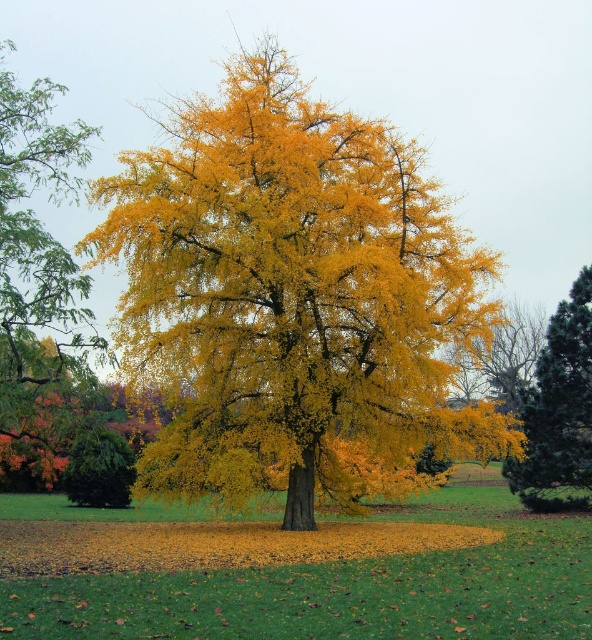
You are standing in a park and see two trees at the center. One is a yellow leafy tree at center and the other is a yellow matte tree at center. Which one do you think is closer to you?

The yellow leafy tree at center is closer to the viewer than the yellow matte tree at center.

You are standing at the center of the image and want to walk towards the shiny dark green pine tree at right. In which direction should you move?

The shiny dark green pine tree at right is located at point 0.642 on the x axis and 0.944 on the y axis. Since you are at the center, you should move towards the right and downward to reach it.

You are a bird looking for a place to perch. You see the shiny dark green pine tree at right and the yellow matte tree at center. Which tree is closer to you?

The shiny dark green pine tree at right is closer to you because the yellow matte tree at center is behind it.